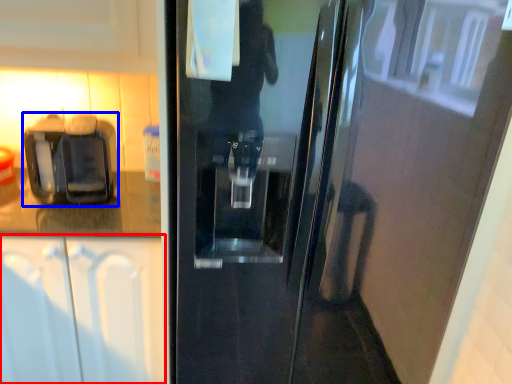
Question: Among these objects, which one is nearest to the camera, cabinetry (highlighted by a red box) or coffee machine (highlighted by a blue box)?

Choices:
 (A) cabinetry
 (B) coffee machine

Answer: (A)